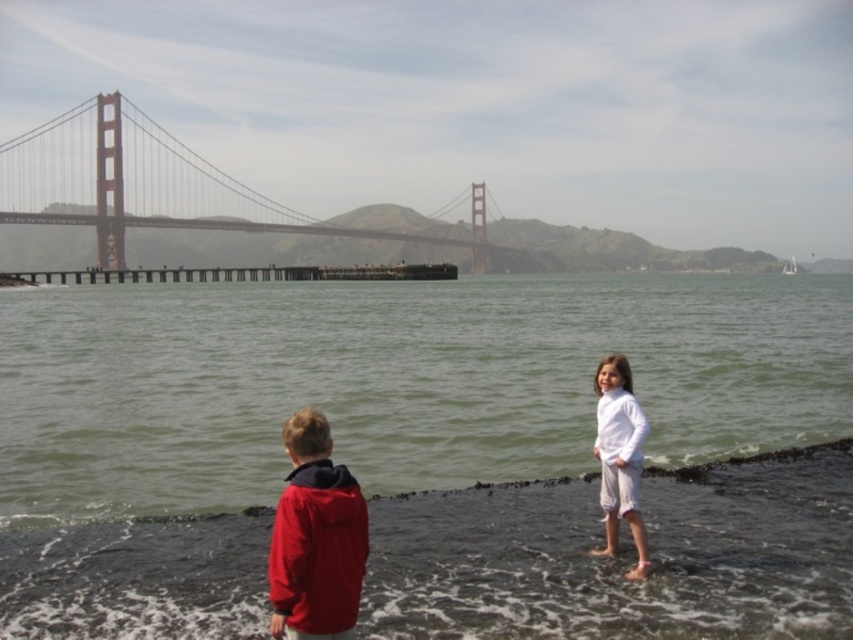
You are a photographer standing at the center of the Golden Gate Bridge scene. You want to focus your camera on the matte red jacket at lower left. What are the coordinates you should aim for?

The coordinates for the matte red jacket at lower left are at point [315,538].

You are a photographer planning to capture a wide shot of the Golden Gate Bridge and the children. Given the scene, will the greenish water at lower center take up more horizontal space in the photo than the metallic bridge at upper center?

The greenish water at lower center has a smaller width than the metallic bridge at upper center, so it will occupy less horizontal space in the photo.

You are a photographer trying to capture the Golden Gate Bridge and the children in the scene. Based on the image, which object, the greenish water at lower center or the metallic bridge at upper center, would appear closer to the camera?

The greenish water at lower center appears closer to the camera because it has a lesser height compared to the metallic bridge at upper center, indicating it is positioned in the foreground.